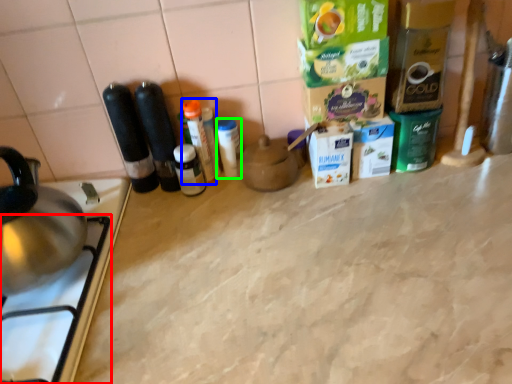
Question: Which is nearer to the gas stove (highlighted by a red box)? bottle (highlighted by a blue box) or bottle (highlighted by a green box).

Choices:
 (A) bottle
 (B) bottle

Answer: (A)